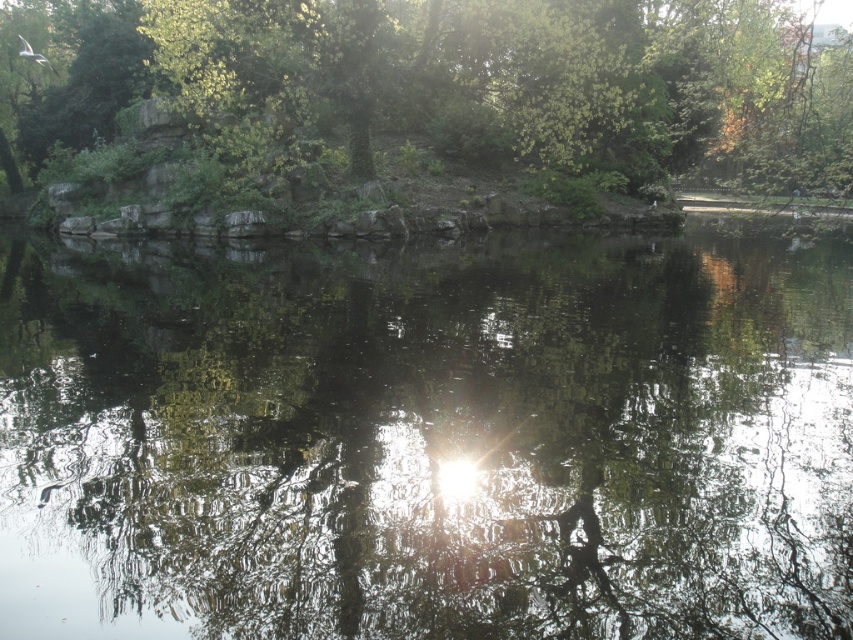
Question: Does transparent water at center appear under green leafy tree at upper center?

Choices:
 (A) no
 (B) yes

Answer: (B)

Question: Can you confirm if transparent water at center is smaller than green leafy tree at upper center?

Choices:
 (A) yes
 (B) no

Answer: (A)

Question: Which object is closer to the camera taking this photo?

Choices:
 (A) green leafy tree at upper center
 (B) transparent water at center

Answer: (B)

Question: Which point appears closest to the camera in this image?

Choices:
 (A) (149, 253)
 (B) (596, 168)

Answer: (A)

Question: Is transparent water at center above green leafy tree at upper center?

Choices:
 (A) yes
 (B) no

Answer: (B)